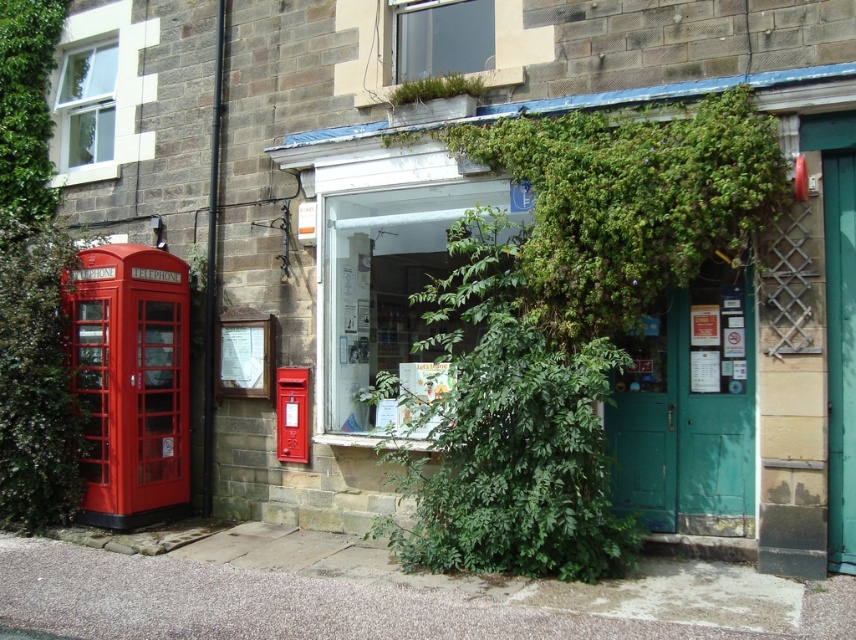
Question: Does green leafy ivy at center have a larger size compared to metallic red postbox at center?

Choices:
 (A) no
 (B) yes

Answer: (B)

Question: Among these objects, which one is farthest from the camera?

Choices:
 (A) green wooden door at center
 (B) green leafy ivy at center
 (C) metallic red postbox at center

Answer: (C)

Question: Is green wooden door at center positioned behind green leafy ivy at center?

Choices:
 (A) no
 (B) yes

Answer: (A)

Question: Which point appears closest to the camera in this image?

Choices:
 (A) coord(520,392)
 (B) coord(727,515)
 (C) coord(302,394)

Answer: (A)

Question: Is green wooden door at center bigger than metallic red postbox at center?

Choices:
 (A) no
 (B) yes

Answer: (B)

Question: Which point is farther from the camera taking this photo?

Choices:
 (A) (302, 438)
 (B) (623, 556)
 (C) (508, 488)

Answer: (A)